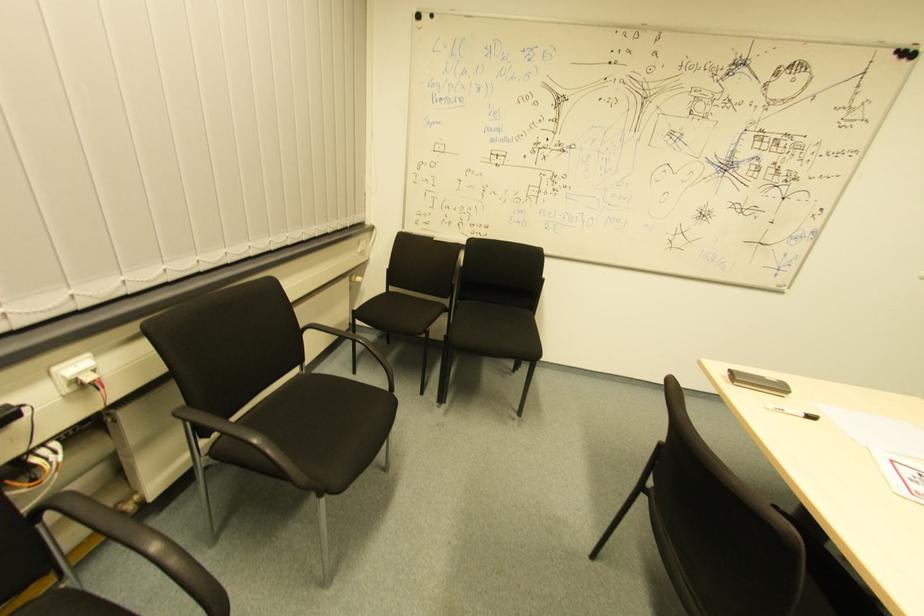
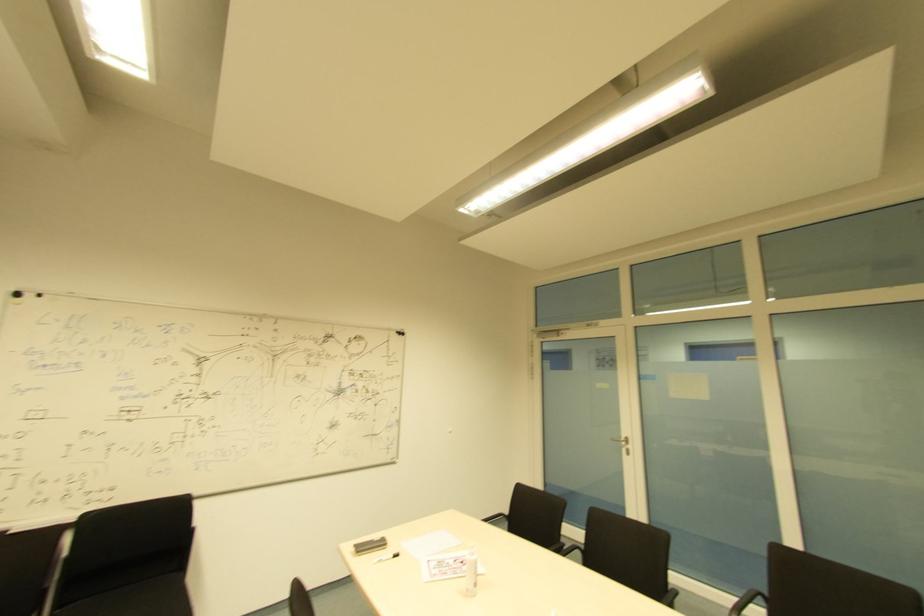
The images are taken continuously from a first-person perspective. In which direction is your viewpoint rotating?

The camera rotated toward right-up.